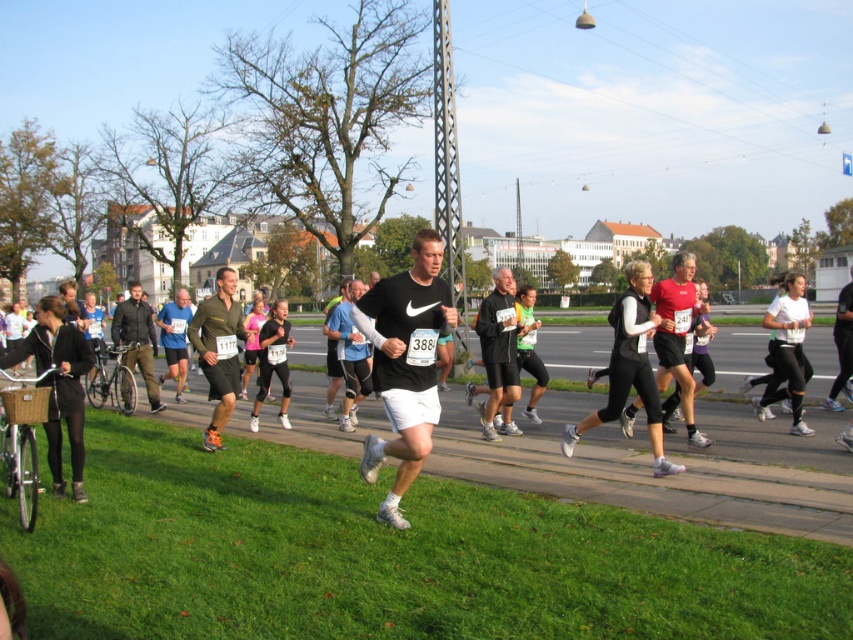
Can you confirm if matte green shorts at center is smaller than matte black shirt at center?

No.

Describe the element at coordinates (218, 349) in the screenshot. I see `matte green shorts at center` at that location.

I want to click on matte green shorts at center, so click(x=218, y=349).

Which is above, matte black shirt at center or dark green fabric pants at left?

Positioned higher is matte black shirt at center.

Does matte black shirt at center have a greater width compared to dark green fabric pants at left?

No.

Which is behind, point (364, 388) or point (141, 324)?

The point (141, 324) is behind.

Find the location of a particular element. Image resolution: width=853 pixels, height=640 pixels. matte black shirt at center is located at coordinates (350, 355).

Measure the distance between matte black jacket at left and dark green fabric pants at left.

A distance of 3.57 meters exists between matte black jacket at left and dark green fabric pants at left.

Which is below, matte black jacket at left or dark green fabric pants at left?

dark green fabric pants at left is lower down.

Identify the location of matte black jacket at left. (57, 385).

This screenshot has height=640, width=853. Identify the location of matte black jacket at left. (57, 385).